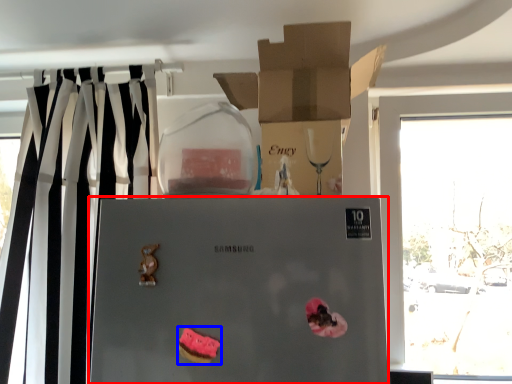
Question: Which object appears farthest to the camera in this image, refrigerator (highlighted by a red box) or stuff (highlighted by a blue box)?

Choices:
 (A) refrigerator
 (B) stuff

Answer: (B)